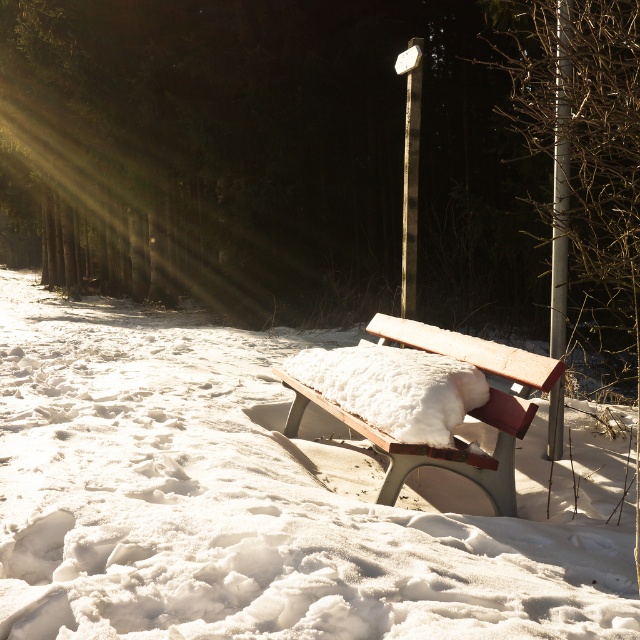
Question: Which point is closer to the camera taking this photo?

Choices:
 (A) (563, 374)
 (B) (417, 83)

Answer: (A)

Question: Among these objects, which one is nearest to the camera?

Choices:
 (A) metallic pole at right
 (B) metallic pole at upper center
 (C) snow-covered wooden bench at center
 (D) white fluffy snow at center

Answer: (D)

Question: Is white fluffy snow at center to the right of snow-covered wooden bench at center from the viewer's perspective?

Choices:
 (A) yes
 (B) no

Answer: (B)

Question: Which is nearer to the white fluffy snow at center?

Choices:
 (A) metallic pole at right
 (B) snow-covered wooden bench at center
 (C) metallic pole at upper center

Answer: (B)

Question: Does snow-covered wooden bench at center lie behind metallic pole at upper center?

Choices:
 (A) no
 (B) yes

Answer: (A)

Question: Can you confirm if snow-covered wooden bench at center is smaller than metallic pole at right?

Choices:
 (A) yes
 (B) no

Answer: (B)